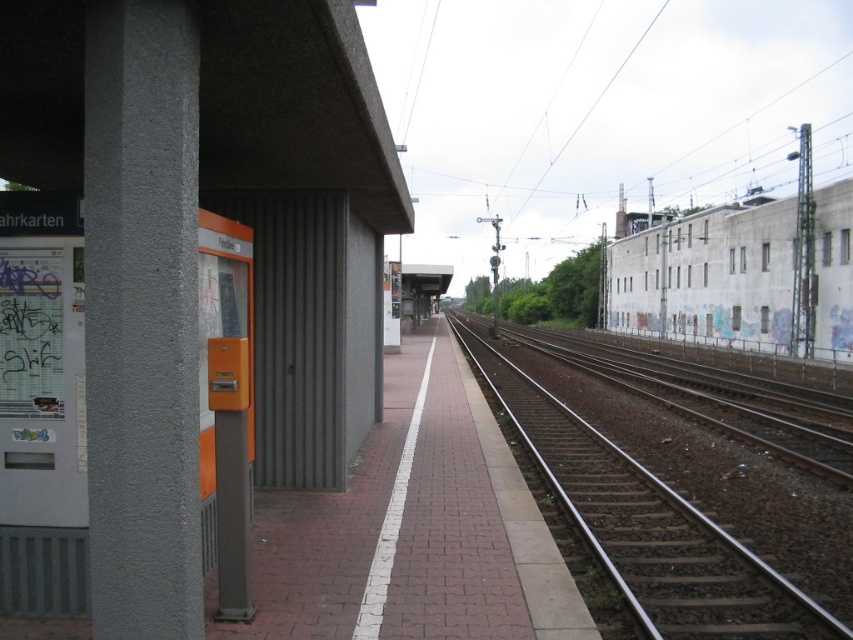
You are a maintenance worker on the platform and need to determine if you can safely place a 1.5 meter tall ladder against the gray concrete pillar at left without it extending beyond the platform edge. The platform edge is marked by the white line next to the brown gravel track at right. Can you do this?

The gray concrete pillar at left is taller than the brown gravel track at right. Since the pillar is taller, placing a 1.5 meter ladder against it would not extend beyond the platform edge as the pillar provides sufficient height.

You are standing at the point marked by coordinates point (x=303, y=147) in the image. What object are you directly in front of?

The point (x=303, y=147) indicates orange plastic vending machine at left, so you are directly in front of the orange plastic vending machine at left.